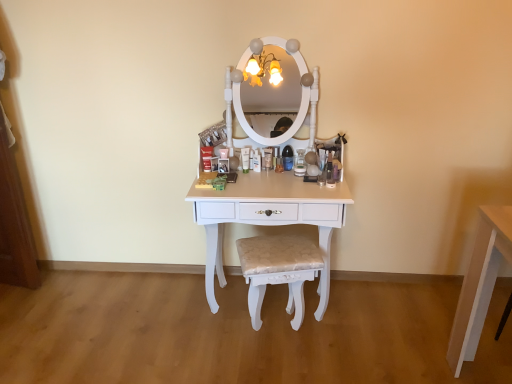
The height and width of the screenshot is (384, 512). I want to click on vacant area located to the right-hand side of beige fabric cushioned stool at center, so click(343, 331).